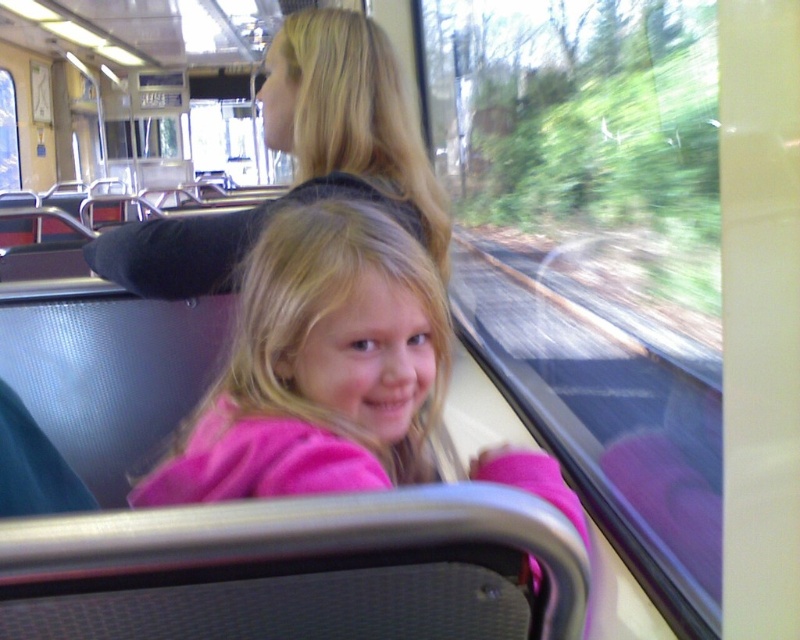
Question: Which object is closer to the camera taking this photo?

Choices:
 (A) pink fleece jacket at center
 (B) transparent glass train window at center

Answer: (A)

Question: In this image, where is transparent glass train window at center located relative to pink fleece jacket at center?

Choices:
 (A) above
 (B) below

Answer: (A)

Question: Can you confirm if transparent glass train window at center is thinner than pink fleece jacket at center?

Choices:
 (A) yes
 (B) no

Answer: (B)

Question: Among these points, which one is farthest from the camera?

Choices:
 (A) (382, 284)
 (B) (510, 376)

Answer: (B)

Question: Considering the relative positions of transparent glass train window at center and pink fleece jacket at center in the image provided, where is transparent glass train window at center located with respect to pink fleece jacket at center?

Choices:
 (A) above
 (B) below

Answer: (A)